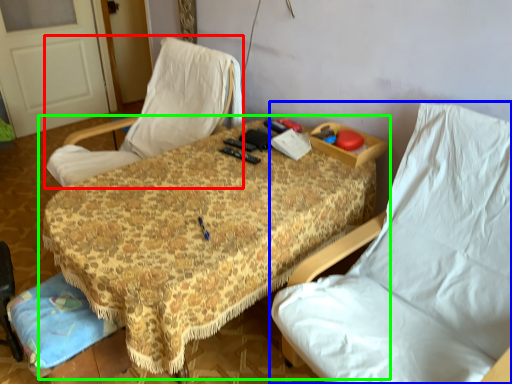
Question: Estimate the real-world distances between objects in this image. Which object is closer to chair (highlighted by a red box), chair (highlighted by a blue box) or table (highlighted by a green box)?

Choices:
 (A) chair
 (B) table

Answer: (B)